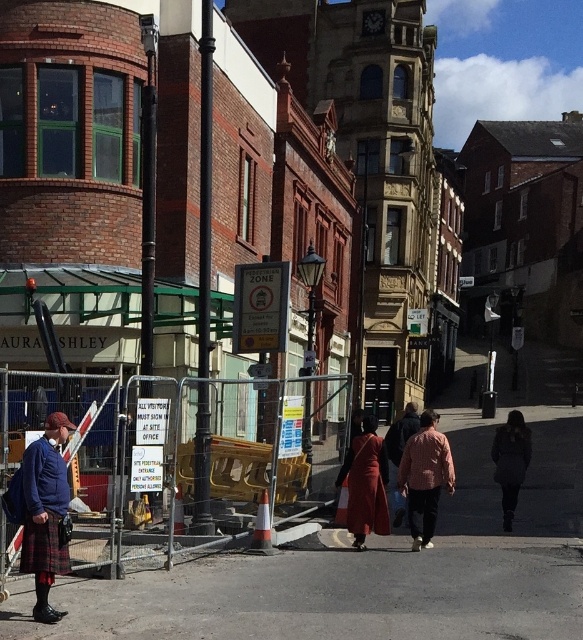
Is tartan fabric kilt at lower left wider than red plaid shirt at center?

In fact, tartan fabric kilt at lower left might be narrower than red plaid shirt at center.

Does tartan fabric kilt at lower left have a greater height compared to red plaid shirt at center?

No, tartan fabric kilt at lower left is not taller than red plaid shirt at center.

Who is more distant from viewer, (55, 545) or (416, 449)?

Positioned behind is point (416, 449).

You are a GUI agent. You are given a task and a screenshot of the screen. Output one action in this format:
    pyautogui.click(x=<x>, y=<y>)
    Task: Click on the tartan fabric kilt at lower left
    
    Given the screenshot: What is the action you would take?
    pyautogui.click(x=45, y=513)

Where is `concrete pavement at center`? The height and width of the screenshot is (640, 583). concrete pavement at center is located at coordinates (382, 554).

Between concrete pavement at center and red plaid shirt at center, which one has more height?

concrete pavement at center is taller.

Which is in front, point (442, 561) or point (431, 454)?

Point (442, 561) is in front.

At what (x,y) coordinates should I click in order to perform the action: click on concrete pavement at center. Please return your answer as a coordinate pair (x, y). This screenshot has height=640, width=583. Looking at the image, I should click on (382, 554).

Does red plaid shirt at center appear on the right side of matte red dress at center?

Yes, red plaid shirt at center is to the right of matte red dress at center.

From the picture: Does red plaid shirt at center have a larger size compared to matte red dress at center?

Yes, red plaid shirt at center is bigger than matte red dress at center.

Is point (437, 449) positioned after point (384, 470)?

That is False.

Find the location of a particular element. Image resolution: width=583 pixels, height=640 pixels. red plaid shirt at center is located at coordinates (424, 477).